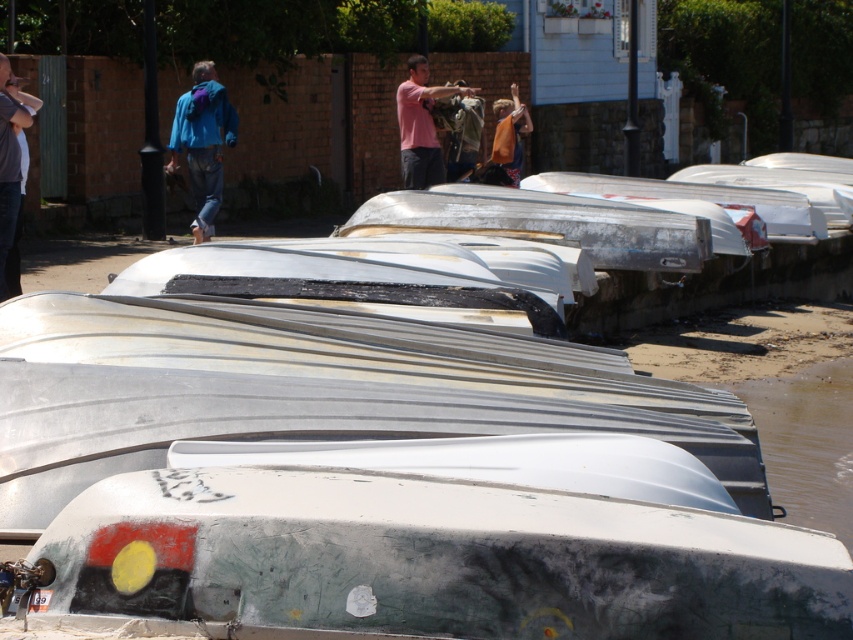
You are standing at the point marked by the coordinates (426, 561) in the image. Looking around, you see a white matte boat at center. Which direction should you face to see the boats arranged in a parallel line extending towards the background?

The white matte boat at center is located at the point marked by the coordinates (426, 561). Since the boats are arranged in a neat, parallel line extending from the foreground into the background, you should face towards the background direction to see the boats arranged in a parallel line extending towards the background.

You are standing at the point with coordinates point (10, 164). Looking around, you see a brushed metal jacket at upper left. What object is located at your current position?

The point (10, 164) corresponds to the location of the brushed metal jacket at upper left.

You are standing on the sandy shore and want to know which object is wider between the white matte boat at center and the matte black jacket at center. Which one is wider?

The white matte boat at center is wider than the matte black jacket at center.